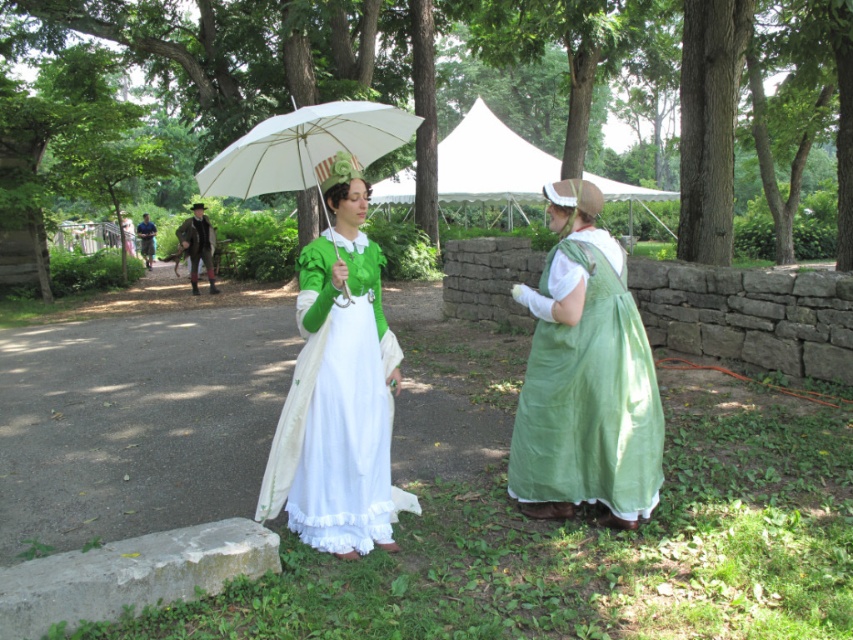
Is matte green dress at center above green satin dress at center?

No, matte green dress at center is not above green satin dress at center.

Is matte green dress at center positioned at the back of green satin dress at center?

That is False.

Identify the location of matte green dress at center. (585, 378).

Which of these two, matte green dress at center or green satin dress at right, stands shorter?

With less height is green satin dress at right.

Between point (514, 451) and point (605, 352), which one is positioned in front?

Point (605, 352)

Identify the location of matte green dress at center. (585, 378).

Which is above, white satin dress at center or white matte umbrella at center?

white matte umbrella at center is above.

Is white satin dress at center shorter than white matte umbrella at center?

No, white satin dress at center is not shorter than white matte umbrella at center.

Find the location of a particular element. The width and height of the screenshot is (853, 640). white satin dress at center is located at coordinates (337, 410).